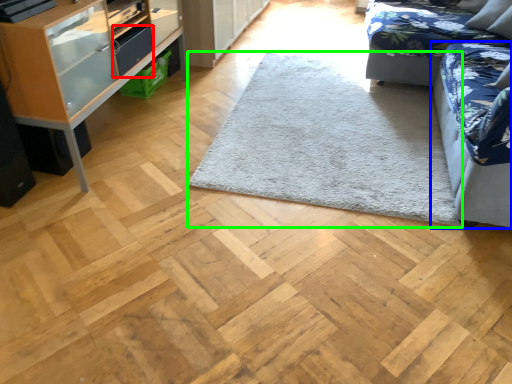
Question: Considering the real-world distances, which object is farthest from drawer (highlighted by a red box)? studio couch (highlighted by a blue box) or mat (highlighted by a green box)?

Choices:
 (A) studio couch
 (B) mat

Answer: (A)